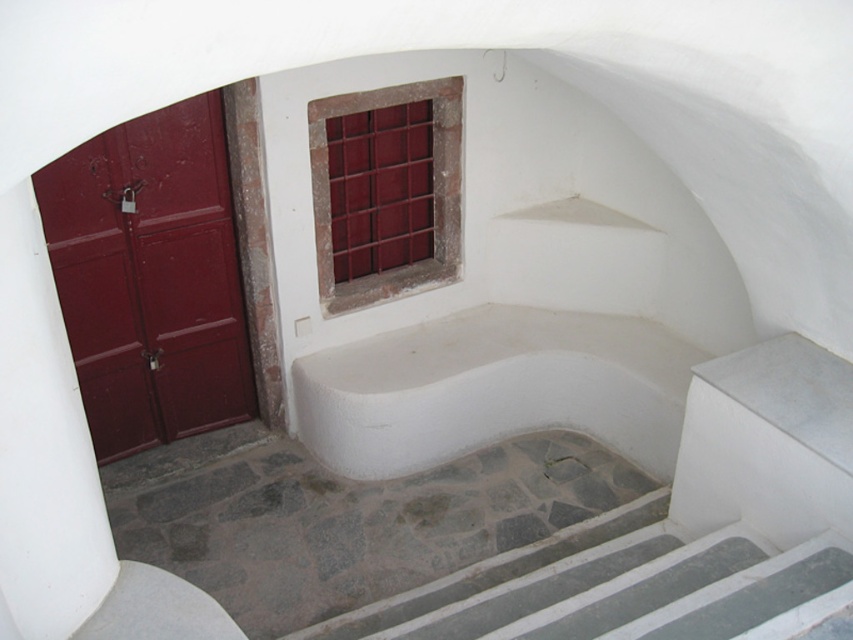
Between gray stone stairs at lower center and maroon glass window at upper center, which one is positioned higher?

maroon glass window at upper center is higher up.

Between gray stone stairs at lower center and maroon glass window at upper center, which one appears on the left side from the viewer's perspective?

maroon glass window at upper center is more to the left.

Measure the distance between gray stone stairs at lower center and camera.

The distance of gray stone stairs at lower center from camera is 11.19 feet.

This screenshot has height=640, width=853. Find the location of `gray stone stairs at lower center`. gray stone stairs at lower center is located at coordinates (619, 588).

Consider the image. Does matte red door at left appear on the left side of gray stone stairs at lower center?

Indeed, matte red door at left is positioned on the left side of gray stone stairs at lower center.

Does point (144, 420) lie behind point (788, 611)?

Yes, point (144, 420) is farther from viewer.

What do you see at coordinates (149, 276) in the screenshot? The image size is (853, 640). I see `matte red door at left` at bounding box center [149, 276].

Locate an element on the screen. Image resolution: width=853 pixels, height=640 pixels. matte red door at left is located at coordinates [149, 276].

Is matte red door at left further to the viewer compared to maroon glass window at upper center?

No, it is in front of maroon glass window at upper center.

Does matte red door at left appear on the left side of maroon glass window at upper center?

Correct, you'll find matte red door at left to the left of maroon glass window at upper center.

Between point (218, 209) and point (457, 260), which one is positioned behind?

The point (457, 260) is behind.

The image size is (853, 640). Identify the location of matte red door at left. [149, 276].